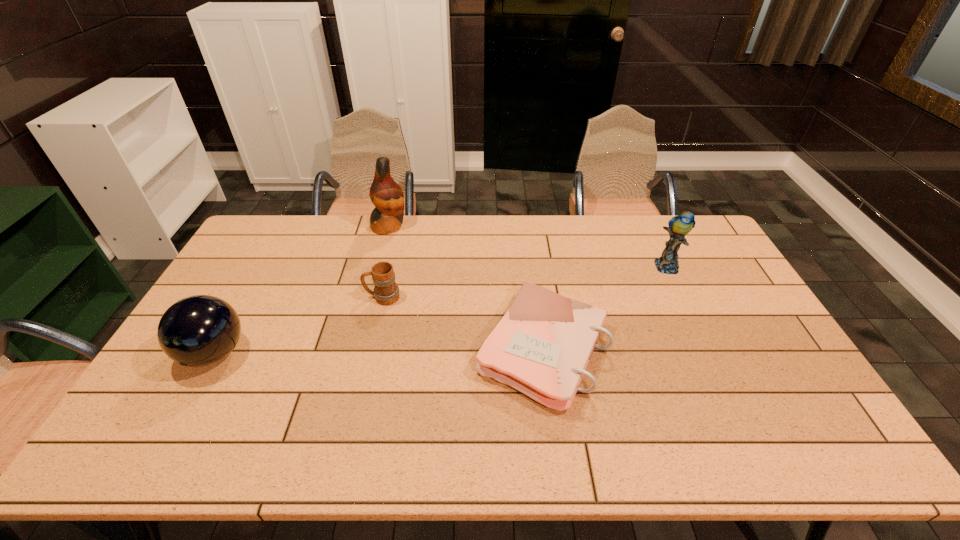
You are a GUI agent. You are given a task and a screenshot of the screen. Output one action in this format:
    pyautogui.click(x=<x>, y=<y>)
    Task: Click on the free space located on the face of the nearer parrot
    This screenshot has height=540, width=960.
    Given the screenshot: What is the action you would take?
    pyautogui.click(x=719, y=376)

Identify the location of free location located 0.180m on the side of the leftmost object with the finger holes. click(x=162, y=447).

Find the location of `vacant space located on the side of the fourth tallest object with the handle`. vacant space located on the side of the fourth tallest object with the handle is located at coordinates [289, 297].

In order to click on free space located on the side of the fourth tallest object with the handle in this screenshot , I will do `click(289, 297)`.

I want to click on free space located 0.220m on the side of the fourth tallest object with the handle, so click(296, 297).

Where is `vacant region located 0.140m on the left of the phonebook`? Image resolution: width=960 pixels, height=540 pixels. vacant region located 0.140m on the left of the phonebook is located at coordinates (425, 349).

The width and height of the screenshot is (960, 540). Find the location of `object present at the far edge`. object present at the far edge is located at coordinates (386, 195).

This screenshot has height=540, width=960. In order to click on object that is positioned at the left edge in this screenshot , I will do `click(200, 330)`.

The height and width of the screenshot is (540, 960). Identify the location of blank space at the far edge of the desktop. (616, 239).

Identify the location of vacant position at the near edge of the desktop. (256, 451).